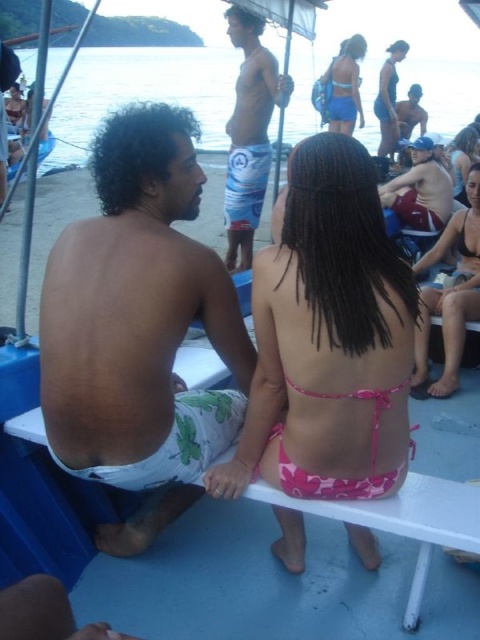
Can you confirm if clear blue water at upper center is positioned to the right of smooth skin man at upper right?

Incorrect, clear blue water at upper center is not on the right side of smooth skin man at upper right.

Which is more to the left, clear blue water at upper center or smooth skin man at upper right?

From the viewer's perspective, clear blue water at upper center appears more on the left side.

Is point (151, 54) more distant than point (405, 102)?

Yes, it is behind point (405, 102).

Find the location of `clear blue water at upper center`. clear blue water at upper center is located at coordinates click(x=142, y=92).

The width and height of the screenshot is (480, 640). What do you see at coordinates (137, 314) in the screenshot? I see `white floral shorts at left` at bounding box center [137, 314].

Who is more forward, [71,236] or [419,104]?

Point [71,236]

Is point (144, 467) less distant than point (398, 138)?

Yes.

Where is `white floral shorts at left`? This screenshot has width=480, height=640. white floral shorts at left is located at coordinates (137, 314).

Who is shorter, blue printed shorts at center or pink fabric bikini at center?

With less height is pink fabric bikini at center.

Does point (264, 184) lie in front of point (429, 314)?

No, (264, 184) is behind (429, 314).

What do you see at coordinates (250, 132) in the screenshot? I see `blue printed shorts at center` at bounding box center [250, 132].

In order to click on blue printed shorts at center in this screenshot , I will do `click(250, 132)`.